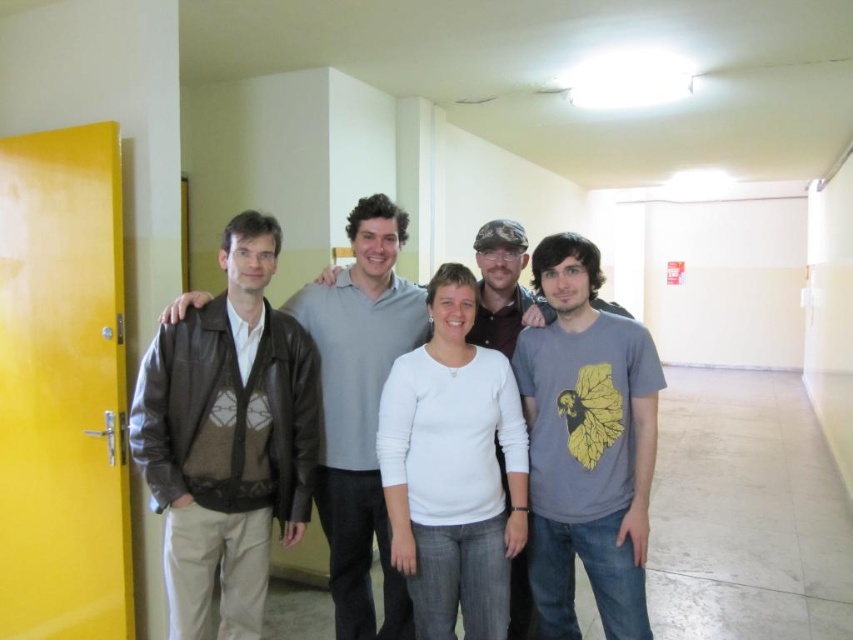
You are standing in the hallway and want to take a photo of the two points mentioned. Which point, point (x=363, y=602) or point (x=512, y=227), will appear larger in the photo?

Point (x=363, y=602) will appear larger in the photo because it is closer to the camera than point (x=512, y=227).

Consider the image. You are standing in the hallway and need to reach the door located at point (543,305). There is an obstacle at point (434,564). Which point should you avoid to reach the door safely?

You should avoid the obstacle at point (434,564) because it is in front of the door located at point (543,305).

You are a photographer standing in front of the group of people in the hallway. You want to take a photo that focuses on the white matte shirt at center and the gray matte shirt at center. Which of these two shirts will appear larger in the photo?

The white matte shirt at center will appear larger in the photo because it is closer to the viewer than the gray matte shirt at center.